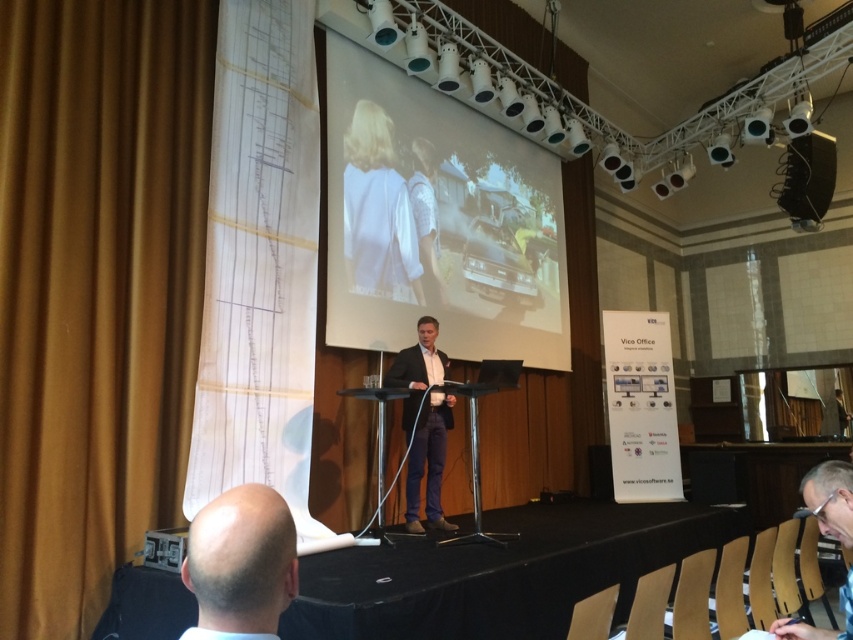
You are a photographer setting up for a presentation. You need to ensure that the white fabric at center and the white cotton shirt at center are visible in your shot. Given that your camera has a minimum focus distance of 12 inches, will both objects be in focus?

The distance between the white fabric at center and the white cotton shirt at center is 13.53 inches. Since the minimum focus distance is 12 inches, the camera can focus on both objects as the distance between them is within the required range.

You are an event photographer who needs to capture a closeup of both the bald head at lower left and the white cotton shirt at center. Which subject requires a wider lens to ensure it fits entirely in the frame?

The white cotton shirt at center requires a wider lens because the bald head at lower left has a smaller width compared to the white cotton shirt at center, so a wider lens would be needed to capture the larger subject fully.